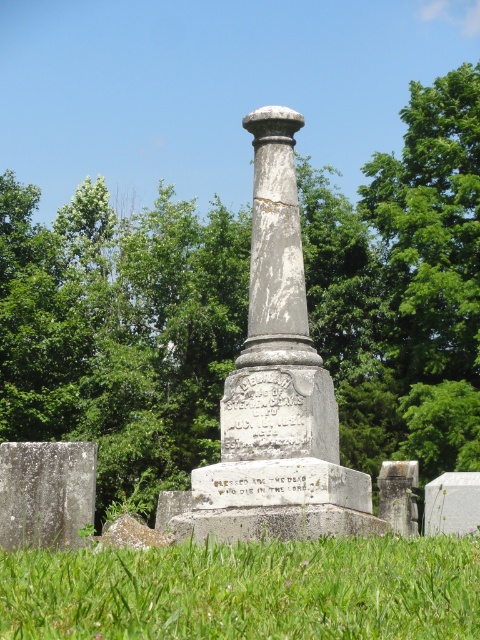
Question: Is green leafy tree at center wider than white stone gravestone at lower left?

Choices:
 (A) no
 (B) yes

Answer: (B)

Question: Among these points, which one is farthest from the camera?

Choices:
 (A) (210, 516)
 (B) (472, 566)

Answer: (A)

Question: Estimate the real-world distances between objects in this image. Which object is closer to the green grass at lower center?

Choices:
 (A) green leafy tree at center
 (B) white marble column at center
 (C) gray stone column at center

Answer: (B)

Question: Which point appears farthest from the camera in this image?

Choices:
 (A) (60, 529)
 (B) (52, 611)
 (C) (458, 148)
 (D) (231, 444)

Answer: (C)

Question: Where is green leafy tree at center located in relation to green grass at lower center in the image?

Choices:
 (A) above
 (B) below

Answer: (A)

Question: Does green grass at lower center appear under gray stone column at center?

Choices:
 (A) no
 (B) yes

Answer: (B)